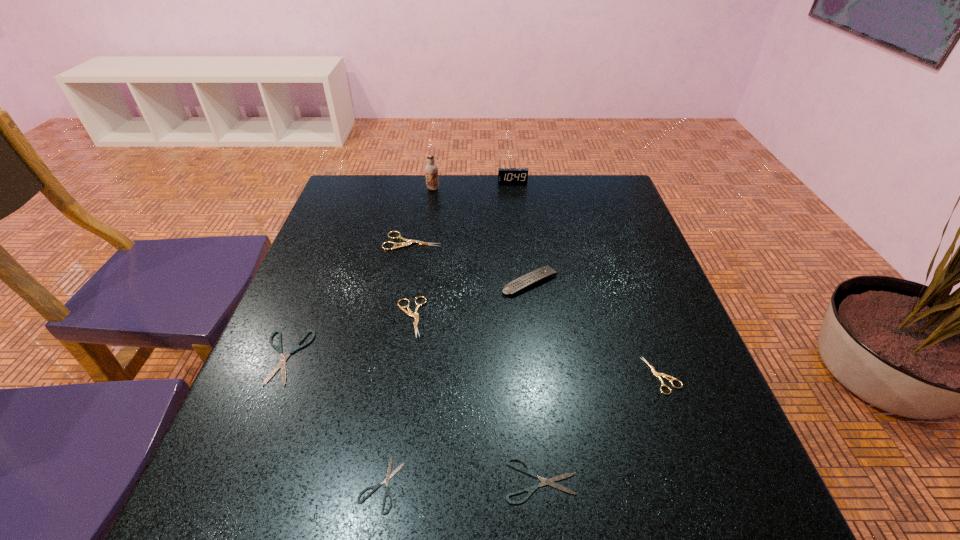
Identify which shears is located as the fourth nearest to the leftmost shears. Please provide its 2D coordinates. Your answer should be formatted as a tuple, i.e. [(x, y)], where the tuple contains the x and y coordinates of a point satisfying the conditions above.

[(550, 482)]

Find the location of a particular element. beige shears that is the third closest to the second smallest black shears is located at coordinates (408, 242).

Where is `beige shears that is the closest to the tallest object`? The height and width of the screenshot is (540, 960). beige shears that is the closest to the tallest object is located at coordinates pyautogui.click(x=408, y=242).

Locate an element on the screen. This screenshot has width=960, height=540. black shears identified as the third closest to the second nearest beige shears is located at coordinates (550, 482).

Locate which black shears ranks second in proximity to the second tallest shears. Please provide its 2D coordinates. Your answer should be formatted as a tuple, i.e. [(x, y)], where the tuple contains the x and y coordinates of a point satisfying the conditions above.

[(389, 476)]

You are a GUI agent. You are given a task and a screenshot of the screen. Output one action in this format:
    pyautogui.click(x=<x>, y=<y>)
    Task: Click on the blank area in the image that satisfies the following two spatial constraints: 1. on the front-facing side of the rightmost shears; 2. on the left side of the farthest object
    This screenshot has height=540, width=960.
    Given the screenshot: What is the action you would take?
    pyautogui.click(x=533, y=375)